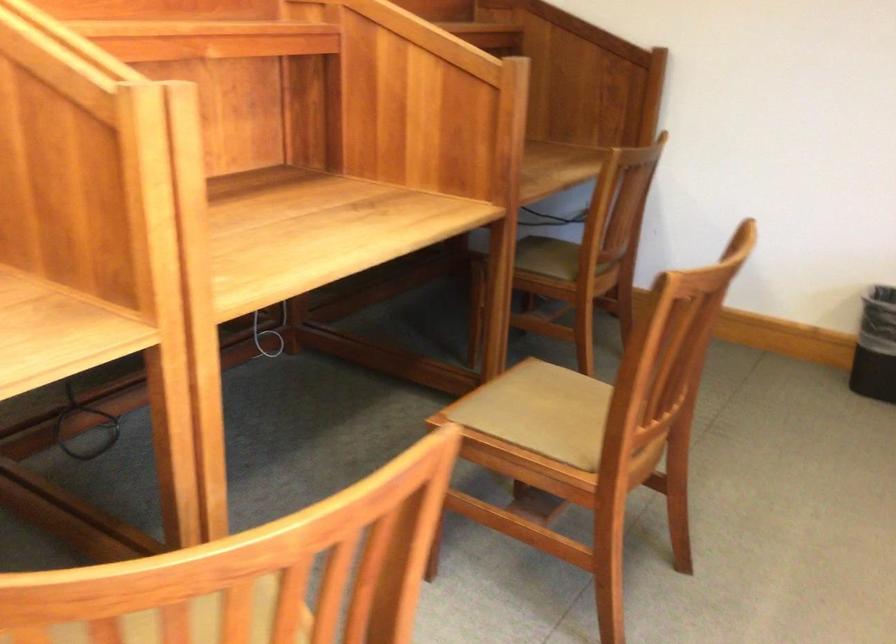
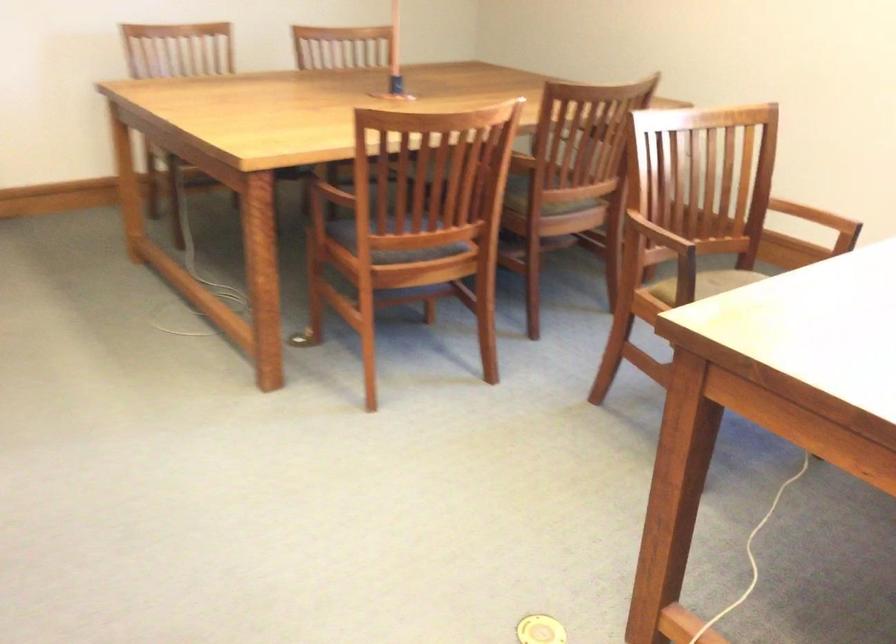
How did the camera likely rotate?

The camera rotated toward right-down.